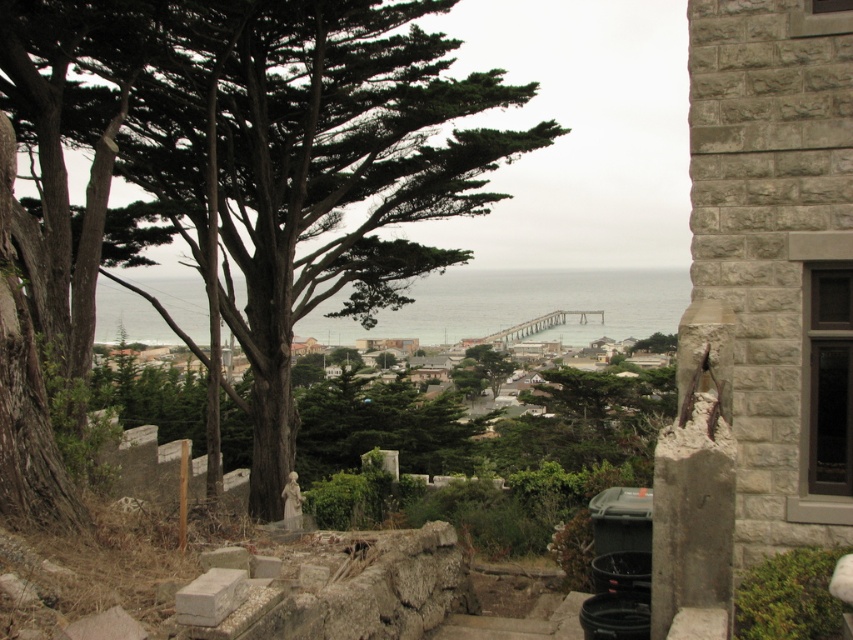
Question: Does green rough bark tree at center appear on the left side of clear water at center?

Choices:
 (A) no
 (B) yes

Answer: (B)

Question: Which of the following is the closest to the observer?

Choices:
 (A) (260, 161)
 (B) (631, 312)

Answer: (A)

Question: Which point is closer to the camera?

Choices:
 (A) (74, 134)
 (B) (440, 305)

Answer: (A)

Question: Among these objects, which one is farthest from the camera?

Choices:
 (A) clear water at center
 (B) green rough bark tree at center

Answer: (A)

Question: Is green rough bark tree at center to the right of clear water at center from the viewer's perspective?

Choices:
 (A) yes
 (B) no

Answer: (B)

Question: Does green rough bark tree at center lie in front of clear water at center?

Choices:
 (A) yes
 (B) no

Answer: (A)